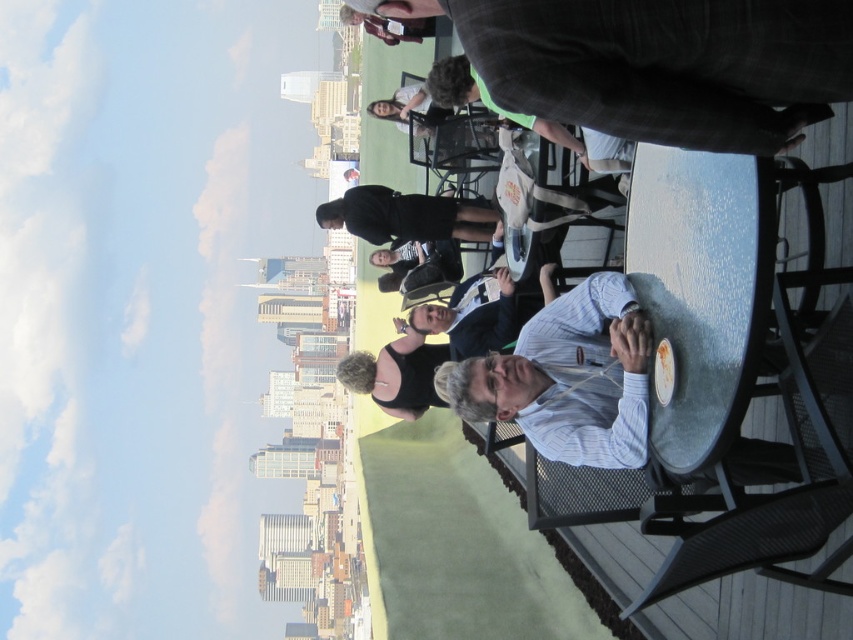
Which is behind, point (640, 337) or point (337, 218)?

Positioned behind is point (337, 218).

Is white striped shirt at center shorter than black matte shirt at center?

In fact, white striped shirt at center may be taller than black matte shirt at center.

Between point (500, 387) and point (457, 204), which one is positioned in front?

Point (500, 387) is in front.

Image resolution: width=853 pixels, height=640 pixels. What are the coordinates of `white striped shirt at center` in the screenshot? It's located at tap(570, 378).

Consider the image. Is white striped shirt at center shorter than striped shirt at center?

Incorrect, white striped shirt at center's height does not fall short of striped shirt at center's.

Which of these two, white striped shirt at center or striped shirt at center, stands shorter?

Standing shorter between the two is striped shirt at center.

Where is `white striped shirt at center`? This screenshot has width=853, height=640. white striped shirt at center is located at coordinates (570, 378).

Which is more to the right, dark gray suit at upper right or black matte shirt at center?

Positioned to the right is dark gray suit at upper right.

Can you confirm if dark gray suit at upper right is bigger than black matte shirt at center?

Yes.

Locate an element on the screen. dark gray suit at upper right is located at coordinates (657, 64).